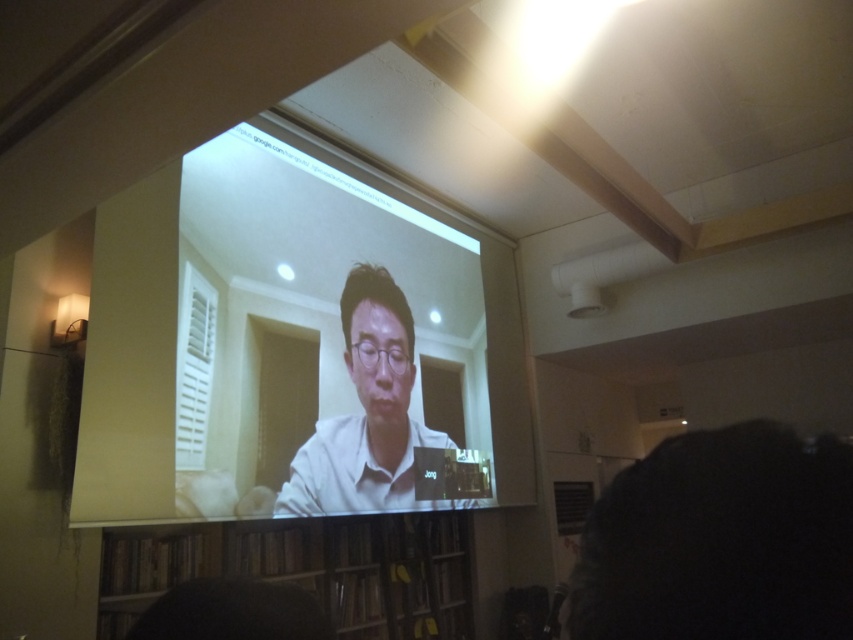
Image resolution: width=853 pixels, height=640 pixels. What do you see at coordinates (291, 337) in the screenshot?
I see `white glossy projector screen at upper center` at bounding box center [291, 337].

This screenshot has width=853, height=640. I want to click on white glossy projector screen at upper center, so (x=291, y=337).

Between point (109, 296) and point (351, 349), which one is positioned behind?

Positioned behind is point (351, 349).

Where is `white glossy projector screen at upper center`? This screenshot has width=853, height=640. white glossy projector screen at upper center is located at coordinates tap(291, 337).

This screenshot has height=640, width=853. Describe the element at coordinates (310, 570) in the screenshot. I see `brown wooden bookshelf at lower center` at that location.

Who is more forward, (427, 563) or (399, 310)?

Point (399, 310)

The height and width of the screenshot is (640, 853). Describe the element at coordinates (310, 570) in the screenshot. I see `brown wooden bookshelf at lower center` at that location.

This screenshot has width=853, height=640. In order to click on brown wooden bookshelf at lower center in this screenshot , I will do `click(310, 570)`.

Describe the element at coordinates (291, 337) in the screenshot. I see `white glossy projector screen at upper center` at that location.

Is white glossy projector screen at upper center wider than brown wooden bookshelf at lower center?

Correct, the width of white glossy projector screen at upper center exceeds that of brown wooden bookshelf at lower center.

Which is in front, point (285, 186) or point (120, 572)?

Point (120, 572) is more forward.

What are the coordinates of `white glossy projector screen at upper center` in the screenshot? It's located at (291, 337).